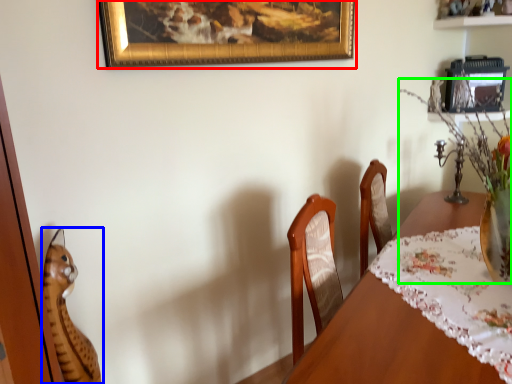
Question: Estimate the real-world distances between objects in this image. Which object is farther from picture frame (highlighted by a red box), cat (highlighted by a blue box) or floral arrangement (highlighted by a green box)?

Choices:
 (A) cat
 (B) floral arrangement

Answer: (A)